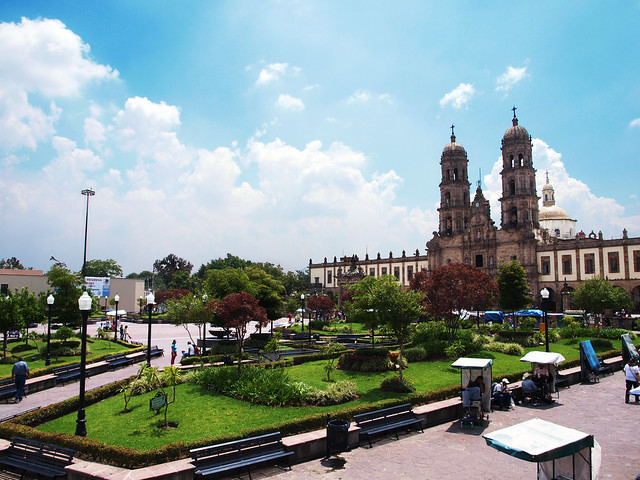
Where is `bench`? Image resolution: width=640 pixels, height=480 pixels. bench is located at coordinates (388, 430).